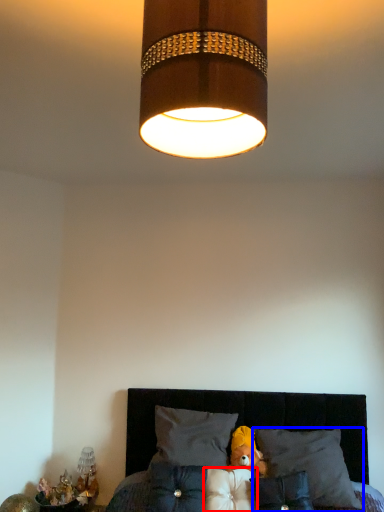
Question: Which object appears farthest to the camera in this image, pillow (highlighted by a red box) or pillow (highlighted by a blue box)?

Choices:
 (A) pillow
 (B) pillow

Answer: (B)